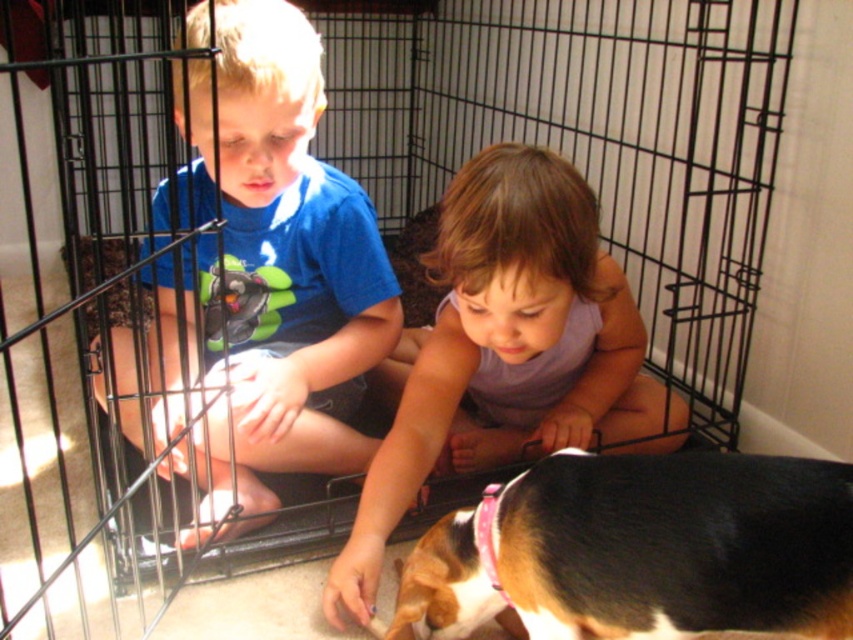
You are a photographer trying to capture a closeup of the black and white fur at lower right and the pastel purple fabric at center. Which object should you focus on first to ensure both are in focus?

The black and white fur at lower right is closer to the viewer than the pastel purple fabric at center. To ensure both are in focus, focus on the black and white fur at lower right first since it is closer, and the depth of field may extend to the farther object.

You are a tailor who needs to determine which material is more suitable for a winter coat. Based on the thickness of the materials shown in the image, which item would you choose between the black and white fur at lower right and the pastel purple fabric at center?

The pastel purple fabric at center is thicker than the black and white fur at lower right, so the pastel purple fabric at center would be more suitable for a winter coat.

You are a fashion designer observing the clothing items in the scene. Which clothing item has a bigger size between the blue cotton shirt at left and the pastel purple fabric at center?

The blue cotton shirt at left is larger in size than the pastel purple fabric at center.